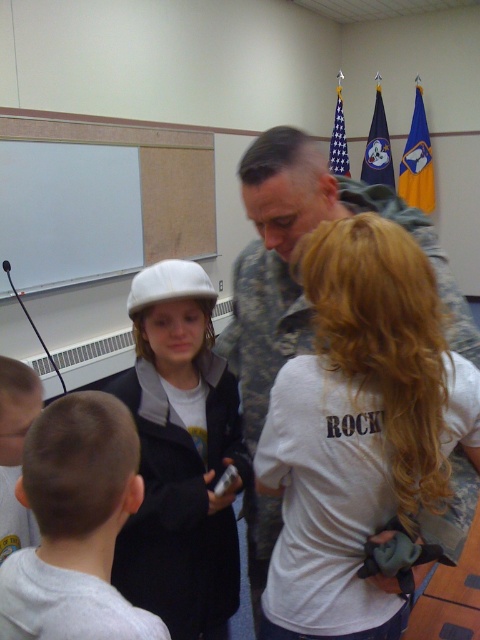
From the picture: You are a photographer setting up a shot of the scene. You need to ensure the white matte helmet at upper left and the camouflage uniform at center are both in focus. Given that your camera can only focus on objects at the same height, is this possible?

The white matte helmet at upper left is below the camouflage uniform at center, so they are at different heights. Therefore, the camera cannot focus on both at the same time since they are not at the same height.

You are a photographer standing in front of the scene. You want to take a photo of both point (x=331, y=436) and point (x=45, y=525). Which point is closer to the camera?

Point (x=45, y=525) is closer to the camera than point (x=331, y=436) because the description states that point (x=331, y=436) is further to the camera than point (x=45, y=525).